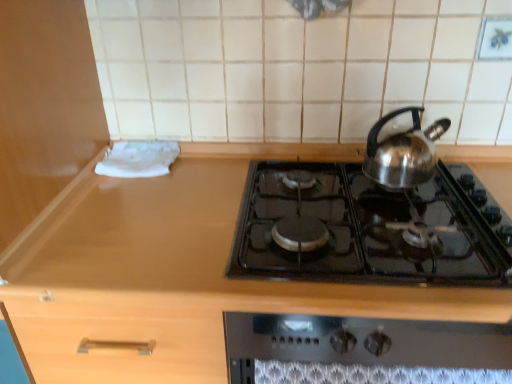
Question: From the image's perspective, is shiny metallic kettle at upper right located above or below wooden counter at center?

Choices:
 (A) above
 (B) below

Answer: (A)

Question: In the image, is shiny metallic kettle at upper right on the left side or the right side of wooden counter at center?

Choices:
 (A) right
 (B) left

Answer: (A)

Question: Estimate the real-world distances between objects in this image. Which object is closer to the black glass gas stove at center?

Choices:
 (A) shiny metallic kettle at upper right
 (B) wooden counter at center

Answer: (A)

Question: Which object is positioned closest to the shiny metallic kettle at upper right?

Choices:
 (A) black glass gas stove at center
 (B) wooden counter at center

Answer: (A)